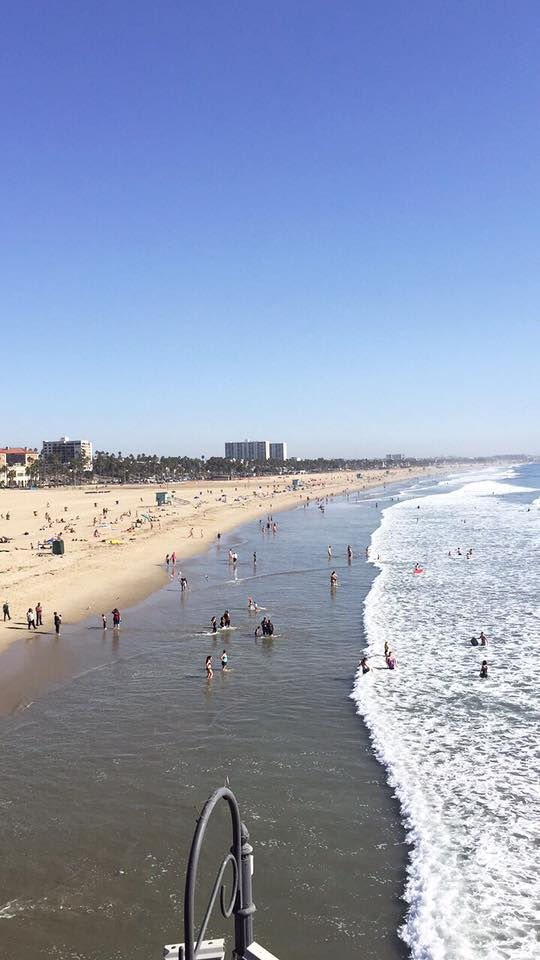
At what (x,y) coordinates should I click in order to perform the action: click on iron. Please return your answer as a coordinate pair (x, y). Looking at the image, I should click on (190, 876).